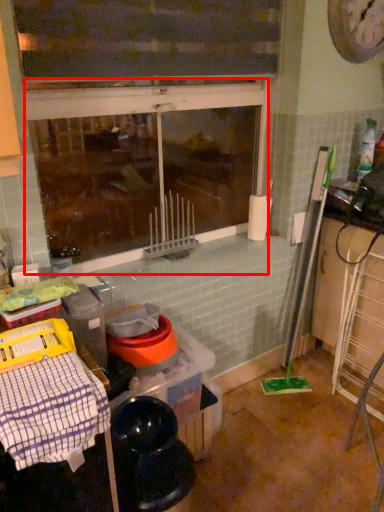
Question: From the image, what is the correct spatial relationship of window (annotated by the red box) in relation to blanket?

Choices:
 (A) right
 (B) left

Answer: (A)